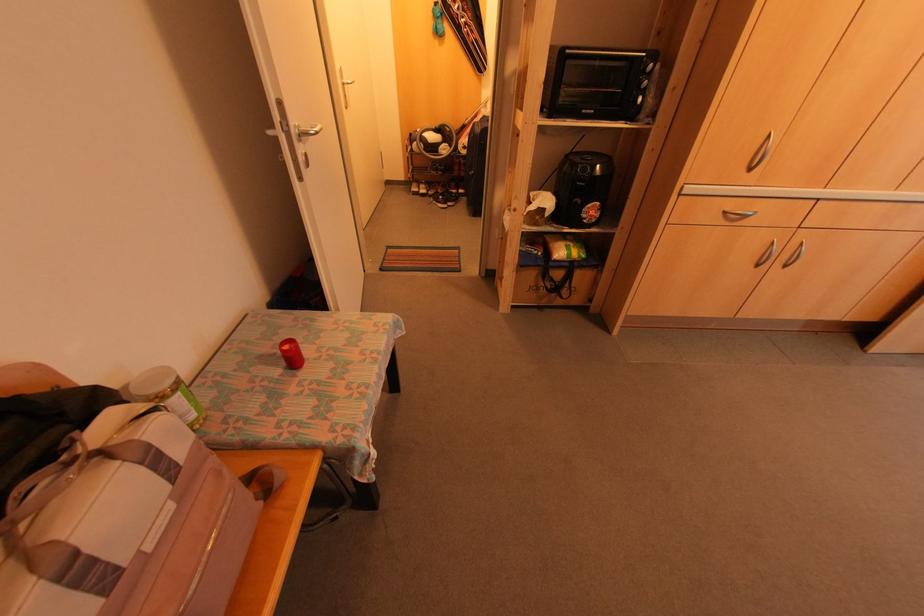
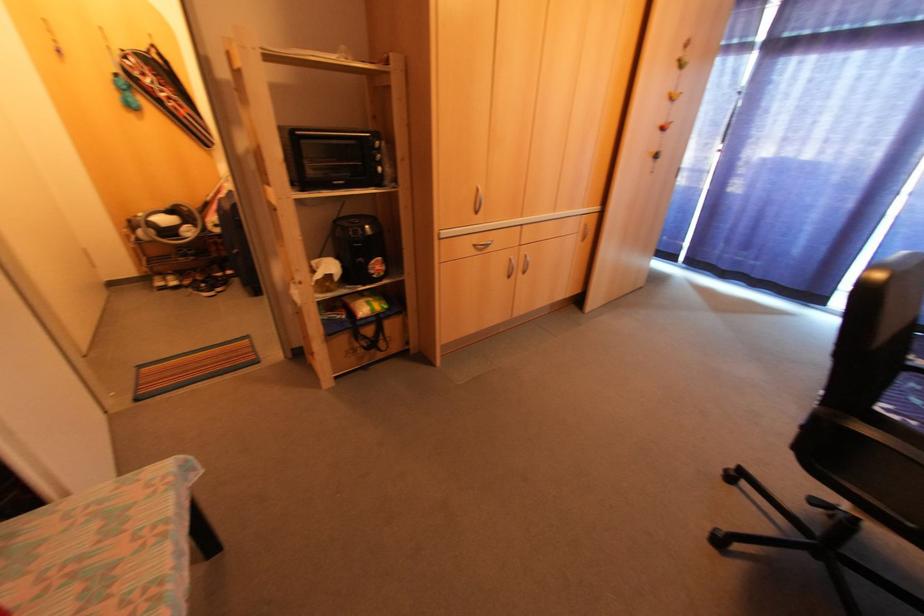
In the second image, find the point that corresponds to point 756,265 in the first image.

(506, 277)